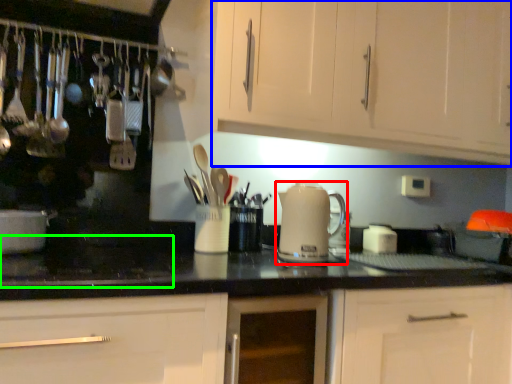
Question: Which object is positioned farthest from kitchen appliance (highlighted by a red box)? Select from cabinetry (highlighted by a blue box) and gas stove (highlighted by a green box).

Choices:
 (A) cabinetry
 (B) gas stove

Answer: (B)